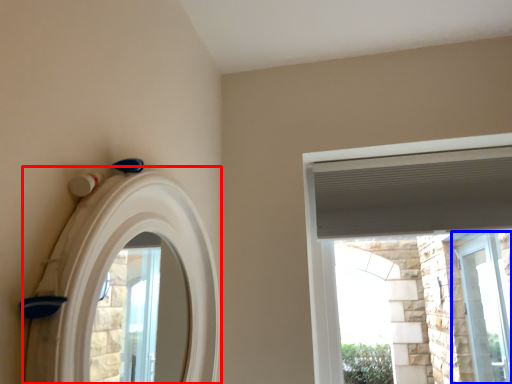
Question: Which point is further to the camera, archway (highlighted by a red box) or window (highlighted by a blue box)?

Choices:
 (A) archway
 (B) window

Answer: (B)